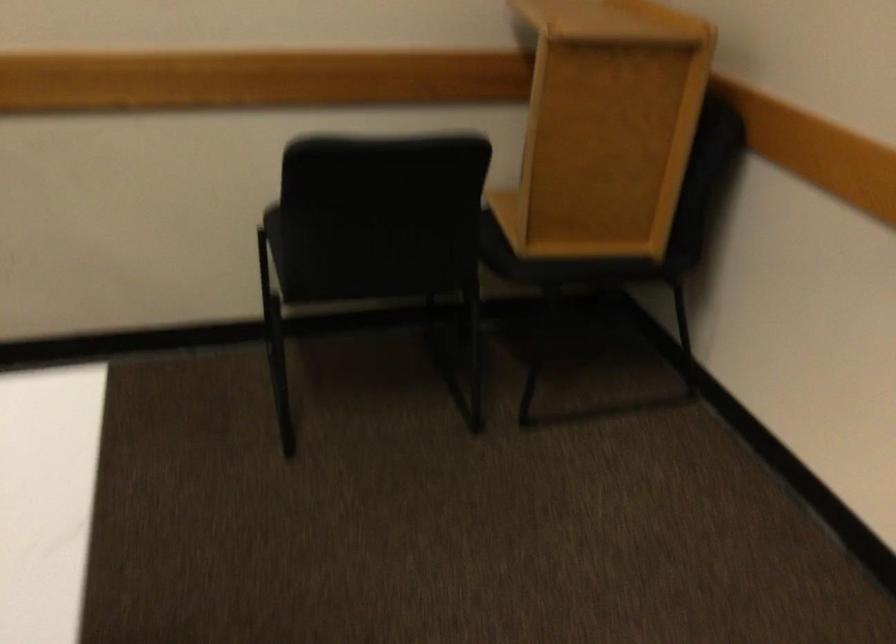
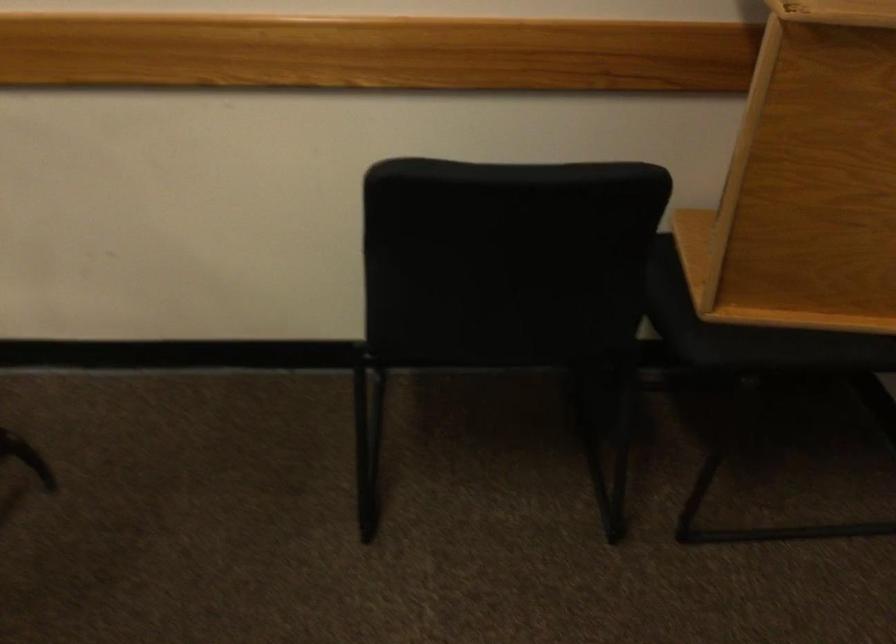
Question: The first image is from the beginning of the video and the second image is from the end. How did the camera likely rotate when shooting the video?

Choices:
 (A) Left
 (B) Right
 (C) Up
 (D) Down

Answer: (A)